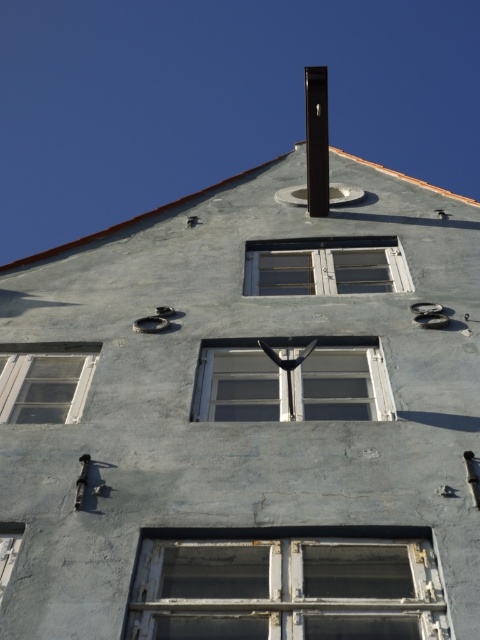
You are an architect reviewing the building design. You need to install a new light fixture between the black matte pole at upper center and the white wooden window at lower left. Based on their positions, which object is closer to the left edge of the building?

The white wooden window at lower left is closer to the left edge of the building because the black matte pole at upper center is positioned to its right side.

You are standing 20 meters away from the building. You want to know if you can see the white wooden window at center clearly. Based on the distance provided, can you confirm if you are within the clear viewing range?

The distance between you and the white wooden window at center is 19.92 meters, which is just under 20 meters. Therefore, you are within the clear viewing range and can see the white wooden window at center clearly.

You are an architect designing a new building and want to place a decorative element at point (324, 266). According to the scene, what object is already present at that location?

The white wooden window at center is located at point (324, 266).